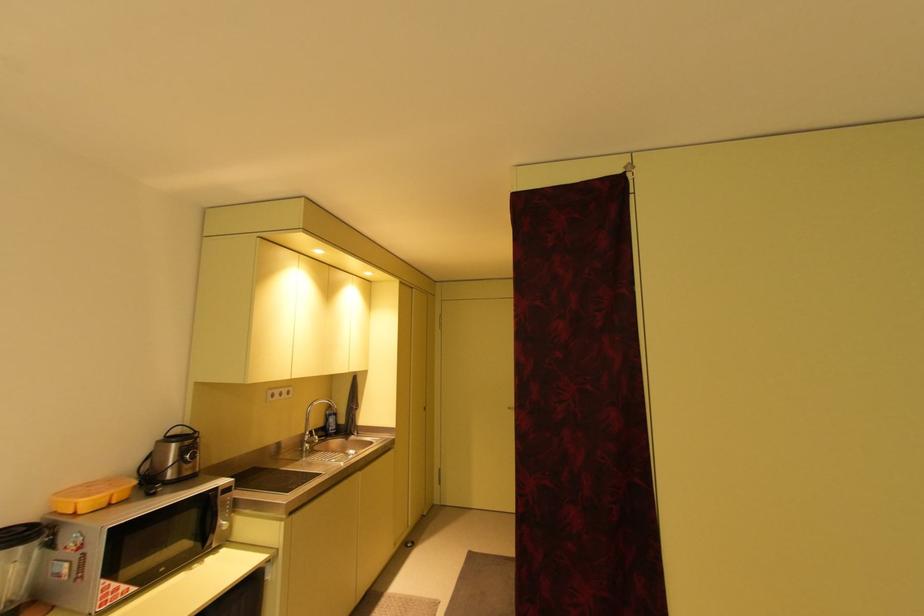
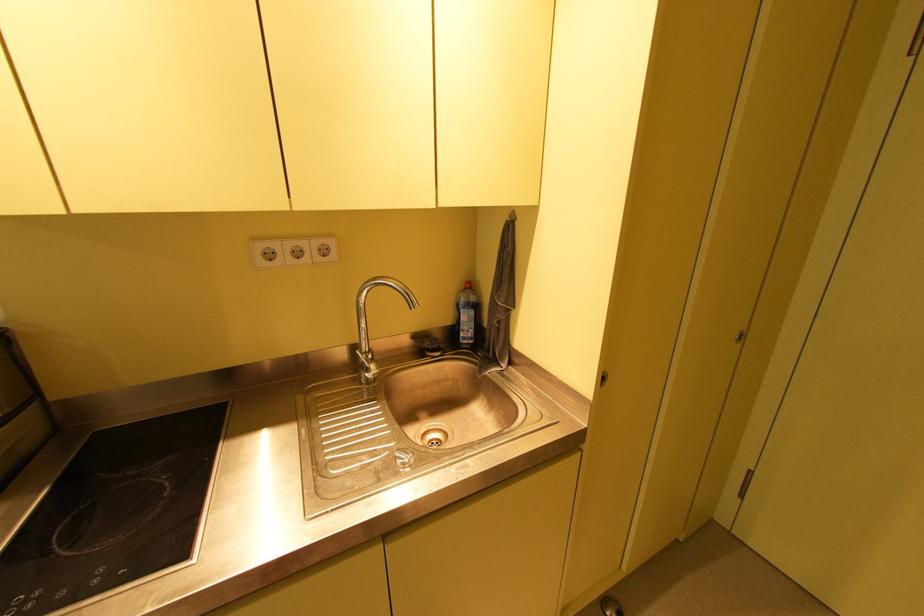
Locate, in the second image, the point that corresponds to (x=339, y=413) in the first image.

(479, 301)